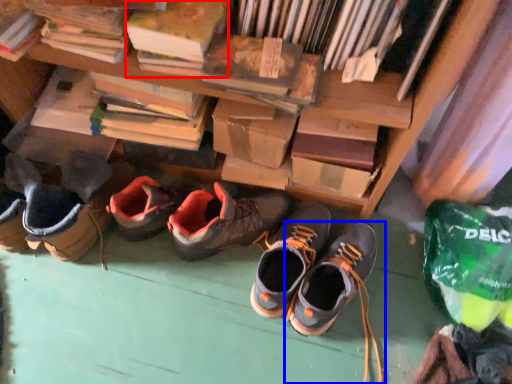
Question: Among these objects, which one is nearest to the camera, paperback book (highlighted by a red box) or footwear (highlighted by a blue box)?

Choices:
 (A) paperback book
 (B) footwear

Answer: (A)